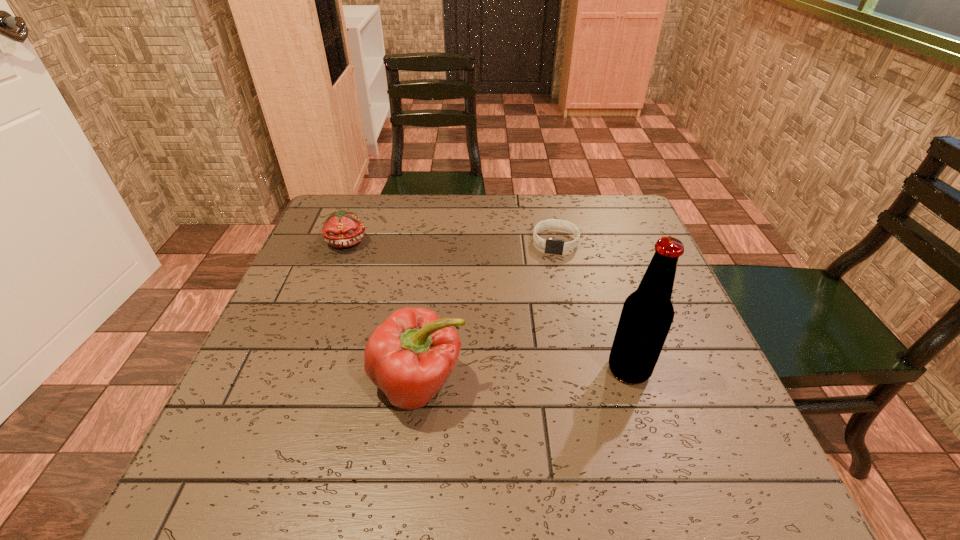
Identify the location of vacant space situated on the front-facing side of the leftmost object. (397, 287).

Image resolution: width=960 pixels, height=540 pixels. I want to click on free space located 0.230m on the outer surface of the shortest object, so click(546, 319).

Find the location of a particular element. The height and width of the screenshot is (540, 960). vacant space located 0.140m on the outer surface of the shortest object is located at coordinates (549, 292).

The height and width of the screenshot is (540, 960). Identify the location of vacant area located 0.160m on the outer surface of the shortest object. click(x=549, y=298).

Locate an element on the screen. The image size is (960, 540). tomato that is at the far edge is located at coordinates (341, 229).

Find the location of `wristband at the far edge`. wristband at the far edge is located at coordinates (551, 245).

Locate an element on the screen. The height and width of the screenshot is (540, 960). object that is positioned at the near edge is located at coordinates (410, 356).

Find the location of `object positioned at the left edge`. object positioned at the left edge is located at coordinates click(x=341, y=229).

The width and height of the screenshot is (960, 540). Find the location of `object that is at the right edge`. object that is at the right edge is located at coordinates point(647,314).

I want to click on object that is at the far left corner, so click(x=341, y=229).